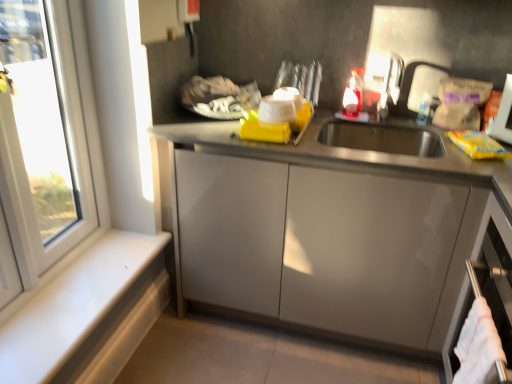
At what (x,y) coordinates should I click in order to perform the action: click on vacant space situated above white matte window sill at lower left (from a real-world perspective). Please return your answer as a coordinate pair (x, y). This screenshot has width=512, height=384. Looking at the image, I should click on (83, 284).